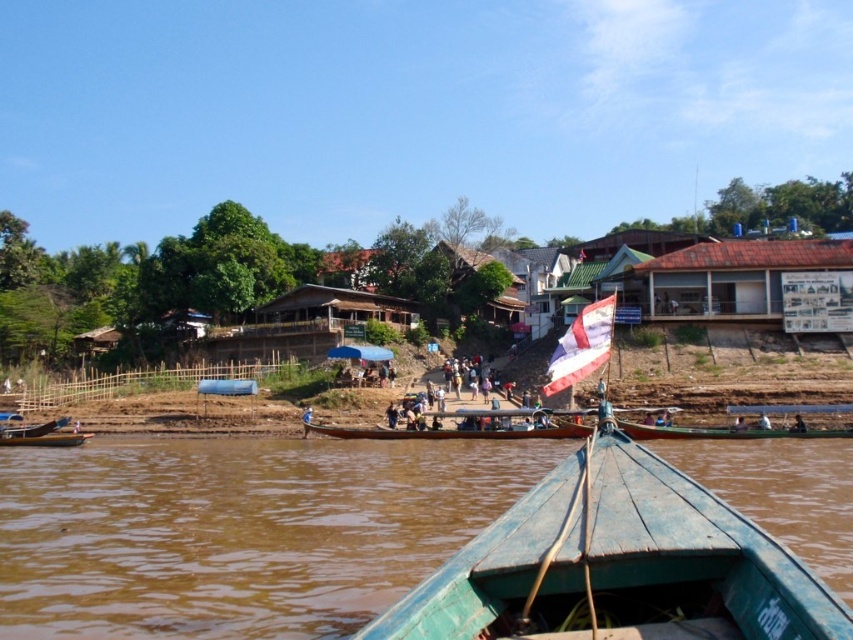
Which is more to the left, wooden hut at center or brown leather jacket at lower center?

Positioned to the left is wooden hut at center.

From the picture: Between wooden hut at center and brown leather jacket at lower center, which one is positioned higher?

wooden hut at center is above.

Who is more forward, (370,301) or (740,424)?

Point (740,424) is more forward.

Locate an element on the screen. wooden hut at center is located at coordinates (337, 307).

Who is lower down, brown wooden boat at center or wooden houses at center?

Positioned lower is brown wooden boat at center.

This screenshot has height=640, width=853. What do you see at coordinates (239, 531) in the screenshot? I see `brown wooden boat at center` at bounding box center [239, 531].

Locate an element on the screen. The width and height of the screenshot is (853, 640). brown wooden boat at center is located at coordinates [x=239, y=531].

Is brown wooden boat at center bigger than striped fabric flag at center?

Correct, brown wooden boat at center is larger in size than striped fabric flag at center.

Which is above, brown wooden boat at center or striped fabric flag at center?

Positioned higher is striped fabric flag at center.

Who is more distant from viewer, (173, 616) or (566, 344)?

The point (566, 344) is more distant.

Locate an element on the screen. brown wooden boat at center is located at coordinates 239,531.